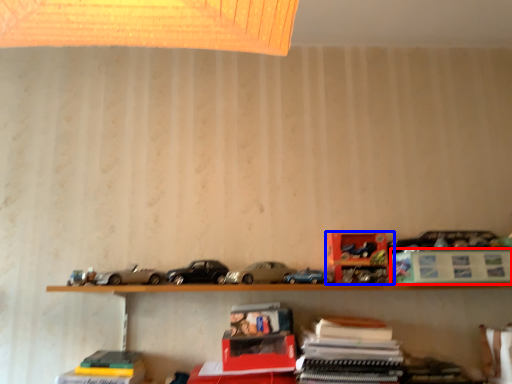
Question: Among these objects, which one is nearest to the camera, paperback book (highlighted by a red box) or toy (highlighted by a blue box)?

Choices:
 (A) paperback book
 (B) toy

Answer: (A)